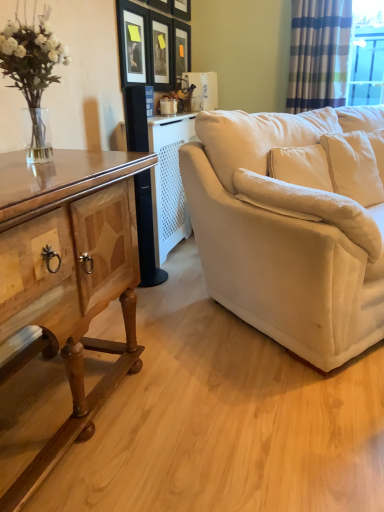
Question: Should I look upward or downward to see matte black picture frame at upper center, marked as the 1th picture frame in a left-to-right arrangement?

Choices:
 (A) down
 (B) up

Answer: (B)

Question: Is velvet beige couch at right at the left side of matte black picture frame at upper center, which is the third picture frame in right-to-left order?

Choices:
 (A) yes
 (B) no

Answer: (B)

Question: Is velvet beige couch at right further to the viewer compared to matte black picture frame at upper center, the second picture frame viewed from the left?

Choices:
 (A) no
 (B) yes

Answer: (A)

Question: Is velvet beige couch at right surrounding matte black picture frame at upper center, the second picture frame viewed from the left?

Choices:
 (A) no
 (B) yes

Answer: (A)

Question: Can you confirm if velvet beige couch at right is wider than matte black picture frame at upper center, the second picture frame viewed from the left?

Choices:
 (A) yes
 (B) no

Answer: (A)

Question: Is velvet beige couch at right smaller than matte black picture frame at upper center, the second picture frame viewed from the left?

Choices:
 (A) no
 (B) yes

Answer: (A)

Question: Does velvet beige couch at right have a greater height compared to matte black picture frame at upper center, the second picture frame viewed from the left?

Choices:
 (A) yes
 (B) no

Answer: (A)

Question: Can you confirm if white glossy coffee cup at center is taller than wooden cabinet at left?

Choices:
 (A) yes
 (B) no

Answer: (B)

Question: Can we say white glossy coffee cup at center lies outside wooden cabinet at left?

Choices:
 (A) yes
 (B) no

Answer: (A)

Question: Considering the relative sizes of white glossy coffee cup at center and wooden cabinet at left in the image provided, is white glossy coffee cup at center wider than wooden cabinet at left?

Choices:
 (A) no
 (B) yes

Answer: (A)

Question: From the image's perspective, is white glossy coffee cup at center beneath wooden cabinet at left?

Choices:
 (A) yes
 (B) no

Answer: (B)

Question: Can you confirm if white glossy coffee cup at center is shorter than wooden cabinet at left?

Choices:
 (A) no
 (B) yes

Answer: (B)

Question: Is white glossy coffee cup at center placed right next to wooden cabinet at left?

Choices:
 (A) yes
 (B) no

Answer: (B)

Question: Considering the relative sizes of striped fabric curtain at upper right and wooden picture frame at upper center, placed as the first picture frame when sorted from right to left, in the image provided, is striped fabric curtain at upper right taller than wooden picture frame at upper center, placed as the first picture frame when sorted from right to left,?

Choices:
 (A) no
 (B) yes

Answer: (B)